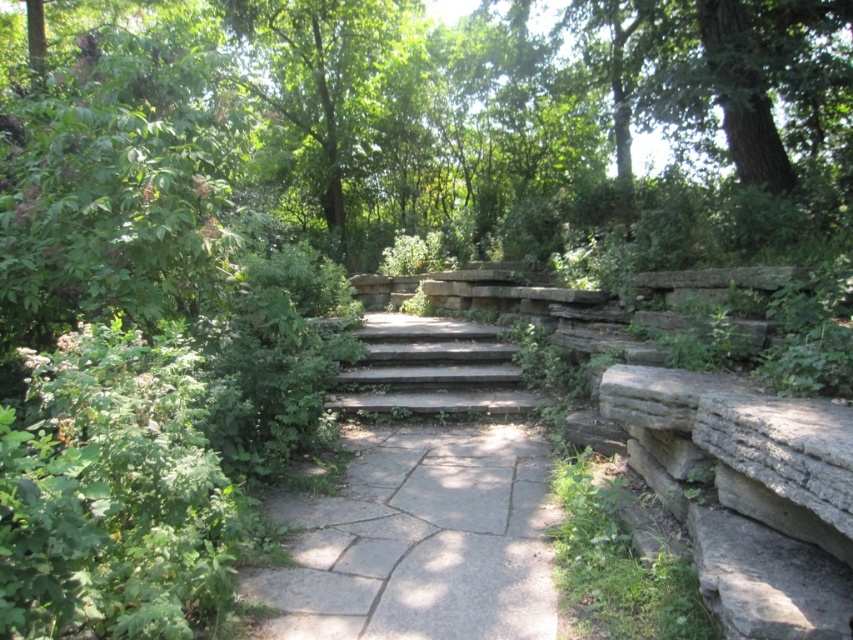
You are a landscape architect designing a garden path. You need to ensure that the gray stone stairs at center are visible from the green leafy tree at upper center. Based on their widths, is there a risk that the tree might block the view of the stairs?

The green leafy tree at upper center might be wider than the gray stone stairs at center, so there is a possibility that the tree could block the view of the stairs depending on their exact positions and the tree canopy spread.

You are standing at the bottom of the stone steps and see the point marked at coordinates (419, 541). Based on the scene description, where is this point located?

The point marked at coordinates (419, 541) is located on the gray stone path at center.

You are a gardener planning to install a small fence along the gray stone path at center. Considering the green leafy tree at upper center, which object is shorter and therefore might require the fence to be lower to avoid blocking the view of the taller object?

The gray stone path at center is shorter than the green leafy tree at upper center, so the fence should be kept low to ensure the tree remains visible.